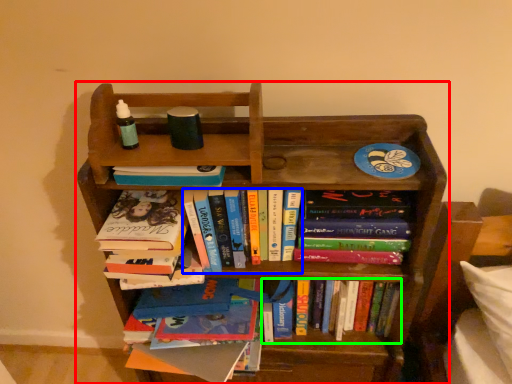
Question: Which object is the farthest from bookcase (highlighted by a red box)? Choose among these: book (highlighted by a blue box) or book (highlighted by a green box).

Choices:
 (A) book
 (B) book

Answer: (B)